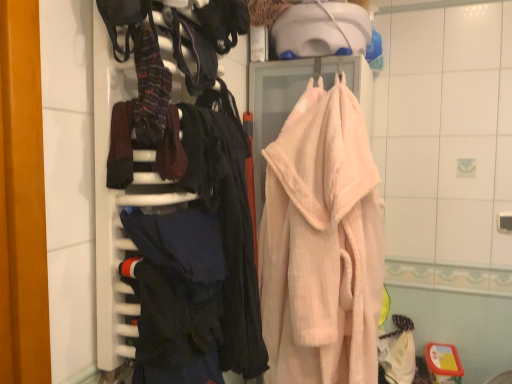
What is the approximate width of dark blue fabric at left?

It is 5.94 inches.

Image resolution: width=512 pixels, height=384 pixels. What do you see at coordinates (321, 243) in the screenshot? I see `pink fluffy bathrobe at center` at bounding box center [321, 243].

Find the location of a particular element. The height and width of the screenshot is (384, 512). dark blue fabric at left is located at coordinates 173,214.

Could you tell me if pink fluffy bathrobe at center is turned towards dark blue fabric at left?

Yes, pink fluffy bathrobe at center is oriented towards dark blue fabric at left.

From a real-world perspective, which is physically above, pink fluffy bathrobe at center or dark blue fabric at left?

dark blue fabric at left is physically above.

At what (x,y) coordinates should I click in order to perform the action: click on closet lying in front of the pink fluffy bathrobe at center. Please return your answer as a coordinate pair (x, y). Looking at the image, I should click on (173, 214).

In terms of size, does pink fluffy bathrobe at center appear bigger or smaller than dark blue fabric at left?

In the image, pink fluffy bathrobe at center appears to be larger than dark blue fabric at left.

Is striped wool socks at upper left, which appears as the 2th clothing when ordered from the bottom, wider or thinner than dark blue fabric at left?

Considering their sizes, striped wool socks at upper left, which appears as the 2th clothing when ordered from the bottom, looks slimmer than dark blue fabric at left.

Is striped wool socks at upper left, which appears as the 2th clothing when ordered from the bottom, to the right of dark blue fabric at left from the viewer's perspective?

No.

Is striped wool socks at upper left, which appears as the 2th clothing when ordered from the bottom, turned away from dark blue fabric at left?

Yes, dark blue fabric at left is at the back of striped wool socks at upper left, which appears as the 2th clothing when ordered from the bottom.

How different are the orientations of striped wool socks at upper left, placed as the 1th clothing when sorted from top to bottom, and dark blue fabric at left in degrees?

striped wool socks at upper left, placed as the 1th clothing when sorted from top to bottom, and dark blue fabric at left are facing 0.000166 degrees away from each other.

Is pink fluffy bathrobe at center wider than dark blue fabric at center, the 1th clothing in the bottom-to-top sequence?

Correct, the width of pink fluffy bathrobe at center exceeds that of dark blue fabric at center, the 1th clothing in the bottom-to-top sequence.

Is the position of pink fluffy bathrobe at center less distant than that of dark blue fabric at center, the 1th clothing in the bottom-to-top sequence?

No, it is behind dark blue fabric at center, the 1th clothing in the bottom-to-top sequence.

Based on the photo, from the image's perspective, between pink fluffy bathrobe at center and dark blue fabric at center, the 1th clothing in the bottom-to-top sequence, which one is located above?

pink fluffy bathrobe at center appears higher in the image.

From a real-world perspective, which is physically below, pink fluffy bathrobe at center or dark blue fabric at center, the 1th clothing in the bottom-to-top sequence?

dark blue fabric at center, the 1th clothing in the bottom-to-top sequence, from a real-world perspective.

Could you tell me if dark blue fabric at center, the second clothing viewed from the top, is turned towards pink fluffy bathrobe at center?

No, dark blue fabric at center, the second clothing viewed from the top, does not turn towards pink fluffy bathrobe at center.

Does dark blue fabric at center, the 1th clothing in the bottom-to-top sequence, have a smaller size compared to pink fluffy bathrobe at center?

Yes.

Is dark blue fabric at center, the second clothing viewed from the top, in front of or behind pink fluffy bathrobe at center in the image?

In the image, dark blue fabric at center, the second clothing viewed from the top, appears in front of pink fluffy bathrobe at center.

Is point (210, 280) farther from camera compared to point (273, 179)?

No.

Does dark blue fabric at left have a larger size compared to striped wool socks at upper left, which appears as the 2th clothing when ordered from the bottom?

Correct, dark blue fabric at left is larger in size than striped wool socks at upper left, which appears as the 2th clothing when ordered from the bottom.

Considering the points (219, 302) and (142, 131), which point is behind, point (219, 302) or point (142, 131)?

The point (219, 302) is farther.

Where is `clothing that appears on the left of dark blue fabric at left`? The width and height of the screenshot is (512, 384). clothing that appears on the left of dark blue fabric at left is located at coordinates (150, 86).

Is dark blue fabric at left wider than striped wool socks at upper left, which appears as the 2th clothing when ordered from the bottom?

Yes.

Does pink fluffy bathrobe at center have a lesser height compared to striped wool socks at upper left, placed as the 1th clothing when sorted from top to bottom?

No, pink fluffy bathrobe at center is not shorter than striped wool socks at upper left, placed as the 1th clothing when sorted from top to bottom.

From the image's perspective, which one is positioned lower, pink fluffy bathrobe at center or striped wool socks at upper left, which appears as the 2th clothing when ordered from the bottom?

pink fluffy bathrobe at center, from the image's perspective.

What's the angular difference between pink fluffy bathrobe at center and striped wool socks at upper left, which appears as the 2th clothing when ordered from the bottom,'s facing directions?

The angular difference between pink fluffy bathrobe at center and striped wool socks at upper left, which appears as the 2th clothing when ordered from the bottom, is 92.5 degrees.

Starting from the pink fluffy bathrobe at center, which clothing is the 2nd one in front? Please provide its 2D coordinates.

[(150, 86)]

Considering the relative sizes of dark blue fabric at center, the second clothing viewed from the top, and dark blue fabric at left in the image provided, is dark blue fabric at center, the second clothing viewed from the top, thinner than dark blue fabric at left?

Indeed, dark blue fabric at center, the second clothing viewed from the top, has a lesser width compared to dark blue fabric at left.

Can you confirm if dark blue fabric at center, the second clothing viewed from the top, is positioned to the right of dark blue fabric at left?

Yes.

Who is more distant, dark blue fabric at center, the 1th clothing in the bottom-to-top sequence, or dark blue fabric at left?

dark blue fabric at center, the 1th clothing in the bottom-to-top sequence, is further from the camera.

Based on the photo, from a real-world perspective, who is located higher, dark blue fabric at center, the second clothing viewed from the top, or dark blue fabric at left?

dark blue fabric at left is physically above.

I want to click on towel lying below the dark blue fabric at left (from the image's perspective), so 321,243.

This screenshot has height=384, width=512. Find the location of `closet below the striped wool socks at upper left, placed as the 1th clothing when sorted from top to bottom (from a real-world perspective)`. closet below the striped wool socks at upper left, placed as the 1th clothing when sorted from top to bottom (from a real-world perspective) is located at coordinates (173, 214).

When comparing their distances from striped wool socks at upper left, which appears as the 2th clothing when ordered from the bottom, does pink fluffy bathrobe at center or dark blue fabric at left seem further?

pink fluffy bathrobe at center.

Which object lies nearer to the anchor point dark blue fabric at left, striped wool socks at upper left, placed as the 1th clothing when sorted from top to bottom, or dark blue fabric at center, the 1th clothing in the bottom-to-top sequence?

dark blue fabric at center, the 1th clothing in the bottom-to-top sequence.

Considering their positions, is dark blue fabric at center, the 1th clothing in the bottom-to-top sequence, positioned further to striped wool socks at upper left, which appears as the 2th clothing when ordered from the bottom, than dark blue fabric at left?

dark blue fabric at center, the 1th clothing in the bottom-to-top sequence, lies further to striped wool socks at upper left, which appears as the 2th clothing when ordered from the bottom, than the other object.

Based on their spatial positions, is pink fluffy bathrobe at center or striped wool socks at upper left, placed as the 1th clothing when sorted from top to bottom, further from dark blue fabric at center, the 1th clothing in the bottom-to-top sequence?

Among the two, pink fluffy bathrobe at center is located further to dark blue fabric at center, the 1th clothing in the bottom-to-top sequence.

From the image, which object appears to be nearer to dark blue fabric at center, the 1th clothing in the bottom-to-top sequence, pink fluffy bathrobe at center or dark blue fabric at left?

Among the two, dark blue fabric at left is located nearer to dark blue fabric at center, the 1th clothing in the bottom-to-top sequence.

Looking at the image, which one is located closer to dark blue fabric at left, dark blue fabric at center, the second clothing viewed from the top, or pink fluffy bathrobe at center?

dark blue fabric at center, the second clothing viewed from the top, lies closer to dark blue fabric at left than the other object.

Which object lies further to the anchor point pink fluffy bathrobe at center, striped wool socks at upper left, placed as the 1th clothing when sorted from top to bottom, or dark blue fabric at center, the second clothing viewed from the top?

striped wool socks at upper left, placed as the 1th clothing when sorted from top to bottom, is further to pink fluffy bathrobe at center.

When comparing their distances from striped wool socks at upper left, placed as the 1th clothing when sorted from top to bottom, does dark blue fabric at left or pink fluffy bathrobe at center seem closer?

Based on the image, dark blue fabric at left appears to be nearer to striped wool socks at upper left, placed as the 1th clothing when sorted from top to bottom.

I want to click on closet between striped wool socks at upper left, which appears as the 2th clothing when ordered from the bottom, and pink fluffy bathrobe at center, in the horizontal direction, so click(x=173, y=214).

The image size is (512, 384). What are the coordinates of `towel between striped wool socks at upper left, placed as the 1th clothing when sorted from top to bottom, and dark blue fabric at center, the second clothing viewed from the top, in the vertical direction` in the screenshot? It's located at (321, 243).

Where is `closet that lies between striped wool socks at upper left, placed as the 1th clothing when sorted from top to bottom, and dark blue fabric at center, the 1th clothing in the bottom-to-top sequence, from top to bottom`? The image size is (512, 384). closet that lies between striped wool socks at upper left, placed as the 1th clothing when sorted from top to bottom, and dark blue fabric at center, the 1th clothing in the bottom-to-top sequence, from top to bottom is located at coordinates (173, 214).

Identify the location of clothing between dark blue fabric at left and pink fluffy bathrobe at center in the horizontal direction. This screenshot has width=512, height=384. (177, 295).